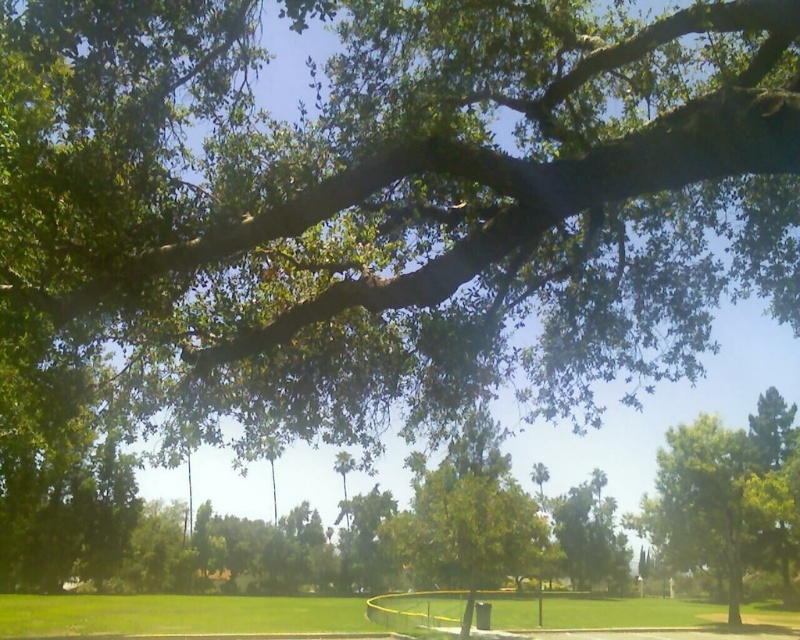
You are standing at the edge of the green grass at lower center and want to walk towards the green leafy tree at center. Which direction should you move to reach it?

The green leafy tree at center is to the right of the green grass at lower center, so you should move to your right to reach it.

You are a park visitor wanting to take a photo of the green leafy tree at center and the green grass at lower center. Which object would you need to stand closer to in order to capture both in a single frame?

The green leafy tree at center is much taller than the green grass at lower center, so you would need to stand closer to the green grass at lower center to include both in the frame.